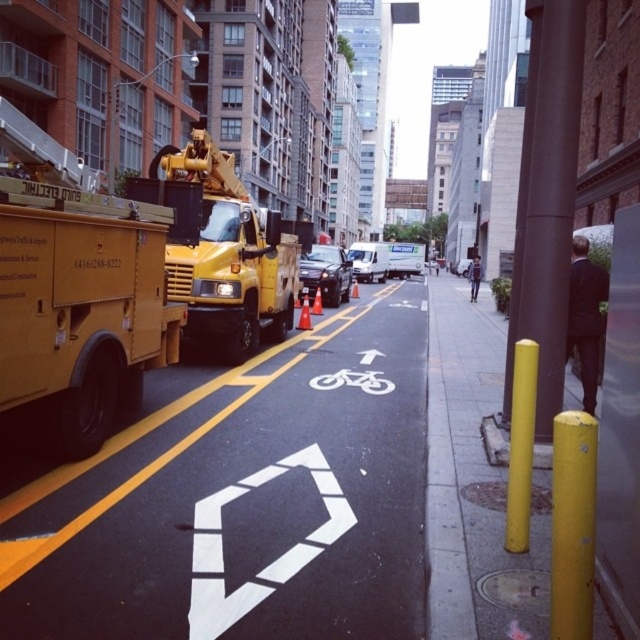
You are a cyclist planning to ride through the white painted bike lane at center. There is a matte yellow truck at center parked on the street. Considering the bike lane is shorter than the truck, is there enough space for you to pass the truck safely?

The white painted bike lane at center is shorter than the matte yellow truck at center, so the bike lane is not long enough to accommodate the truck. This means there may not be enough space for you to pass safely. Consider alternative routes or waiting until the truck moves.

You are a cyclist planning to ride through the white painted bike lane at center while avoiding the matte yellow utility truck at left. Based on the scene, can you safely ride through the bike lane without going around the truck?

The white painted bike lane at center is below the matte yellow utility truck at left, meaning the truck is positioned higher up in the image. Since the truck is parked on the left side of the street, the bike lane is likely in the center and separated by a double yellow line. Therefore, you can safely ride through the bike lane without needing to go around the truck as they are in different lanes.

You are standing on the sidewalk and looking at the yellow utility truck parked on the left side of the street. There are two points marked on the truck. Which point, point 1 at coordinates [230,632] or point 2 at coordinates [154,166], is closer to you?

Point 1 at coordinates [230,632] is closer to you than point 2 at coordinates [154,166].